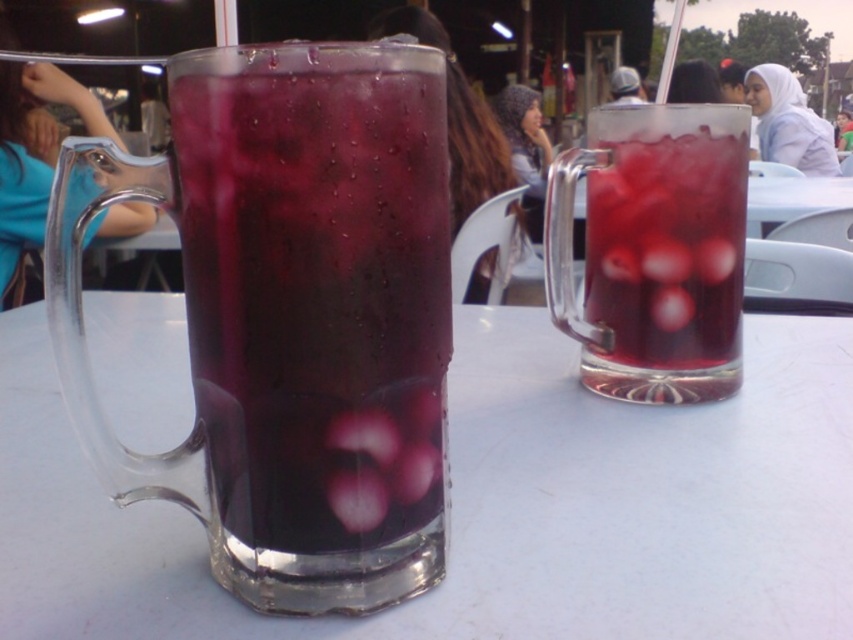
Does dark purple glass at left appear on the right side of translucent glass mug at center?

Incorrect, dark purple glass at left is not on the right side of translucent glass mug at center.

Which is in front, point (210, 68) or point (670, 243)?

Point (210, 68) is more forward.

Measure the distance between point (405, 212) and camera.

Point (405, 212) and camera are 6.96 inches apart.

You are a GUI agent. You are given a task and a screenshot of the screen. Output one action in this format:
    pyautogui.click(x=<x>, y=<y>)
    Task: Click on the dark purple glass at left
    
    Given the screenshot: What is the action you would take?
    pyautogui.click(x=316, y=285)

Is transparent glass mug at center positioned behind dark purple glass at left?

Yes, transparent glass mug at center is further from the viewer.

Is transparent glass mug at center below dark purple glass at left?

Yes.

This screenshot has width=853, height=640. I want to click on transparent glass mug at center, so click(x=492, y=502).

Locate an element on the screen. transparent glass mug at center is located at coordinates (492, 502).

Who is more forward, (492, 480) or (720, 106)?

Point (492, 480) is more forward.

Find the location of a particular element. The height and width of the screenshot is (640, 853). transparent glass mug at center is located at coordinates (492, 502).